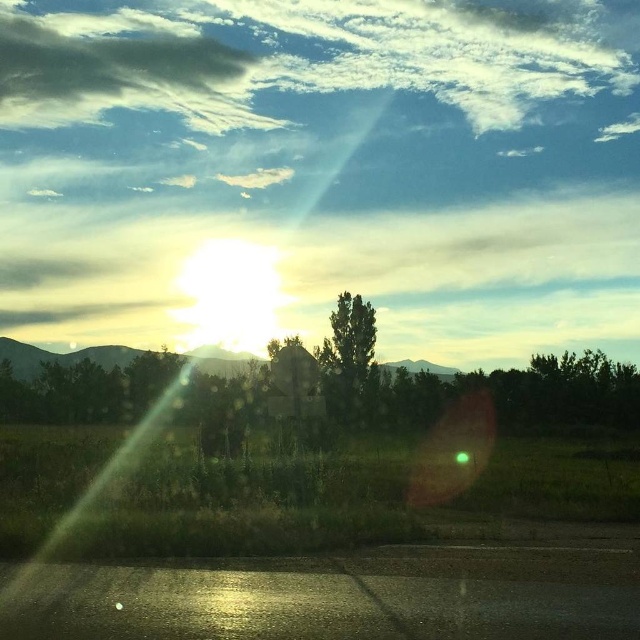
Between green leafy tree at center and green matte tree at center, which one is positioned higher?

green matte tree at center is higher up.

Who is shorter, green leafy tree at center or green matte tree at center?

green leafy tree at center is shorter.

Between point (630, 385) and point (355, 365), which one is positioned behind?

The point (355, 365) is behind.

The height and width of the screenshot is (640, 640). I want to click on green leafy tree at center, so click(518, 392).